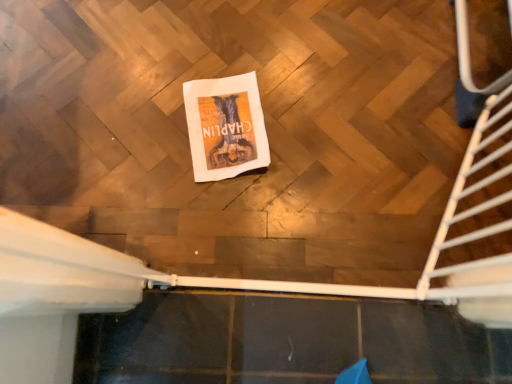
The image size is (512, 384). I want to click on vacant space in between white paper towel at center and white metal stairs at right, so click(x=356, y=146).